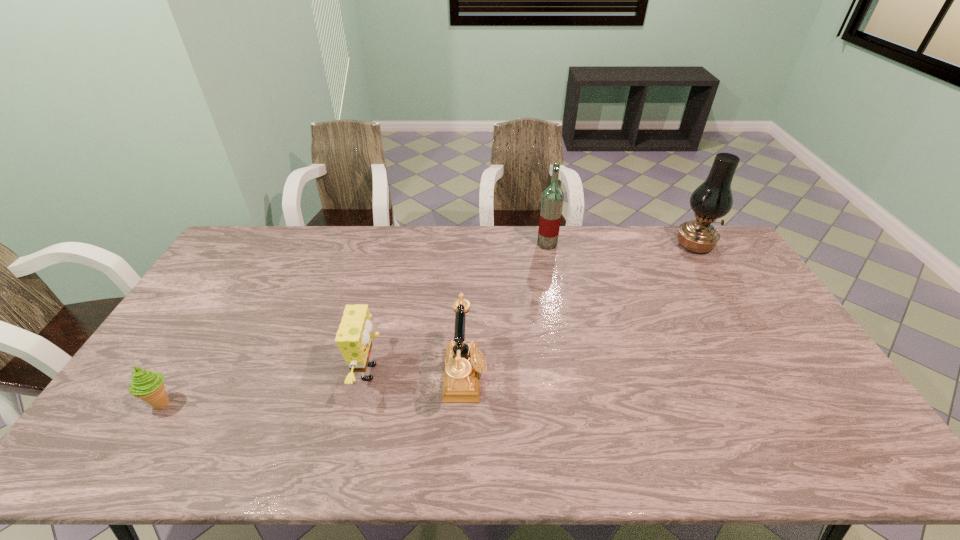
The width and height of the screenshot is (960, 540). In order to click on object that is the fourth closest to the fourth object from left to right in this screenshot , I will do `click(147, 385)`.

Where is `object that is the nearest to the rightmost object`? object that is the nearest to the rightmost object is located at coordinates (552, 199).

At what (x,y) coordinates should I click in order to perform the action: click on vacant area in the image that satisfies the following two spatial constraints: 1. on the front-facing side of the fourth object from right to left; 2. on the front side of the icecream. Please return your answer as a coordinate pair (x, y). The height and width of the screenshot is (540, 960). Looking at the image, I should click on (365, 403).

The height and width of the screenshot is (540, 960). Identify the location of vacant space that satisfies the following two spatial constraints: 1. on the front side of the oil lamp; 2. on the dial of the third object from right to left. (774, 376).